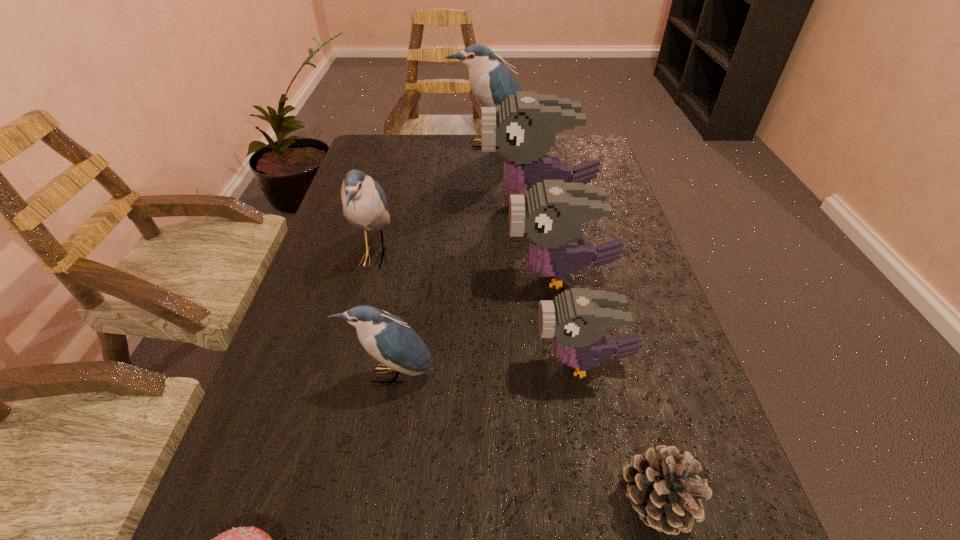
I want to click on the farthest bird, so click(491, 81).

Image resolution: width=960 pixels, height=540 pixels. I want to click on the biggest blue bird, so click(491, 81).

Locate an element on the screen. This screenshot has width=960, height=540. the farthest gray bird is located at coordinates (524, 127).

This screenshot has height=540, width=960. I want to click on the second farthest bird, so click(524, 127).

Where is `the second biggest blue bird`? Image resolution: width=960 pixels, height=540 pixels. the second biggest blue bird is located at coordinates (364, 202).

I want to click on the second smallest gray bird, so point(552,213).

This screenshot has width=960, height=540. I want to click on the smallest blue bird, so click(x=387, y=338).

Locate an element on the screen. The height and width of the screenshot is (540, 960). the smallest gray bird is located at coordinates (578, 318).

I want to click on vacant space located 0.180m at the tip of the biggest blue bird's beak, so click(491, 184).

Locate an element on the screen. This screenshot has width=960, height=540. vacant space located 0.340m at the beak of the farthest gray bird is located at coordinates (356, 200).